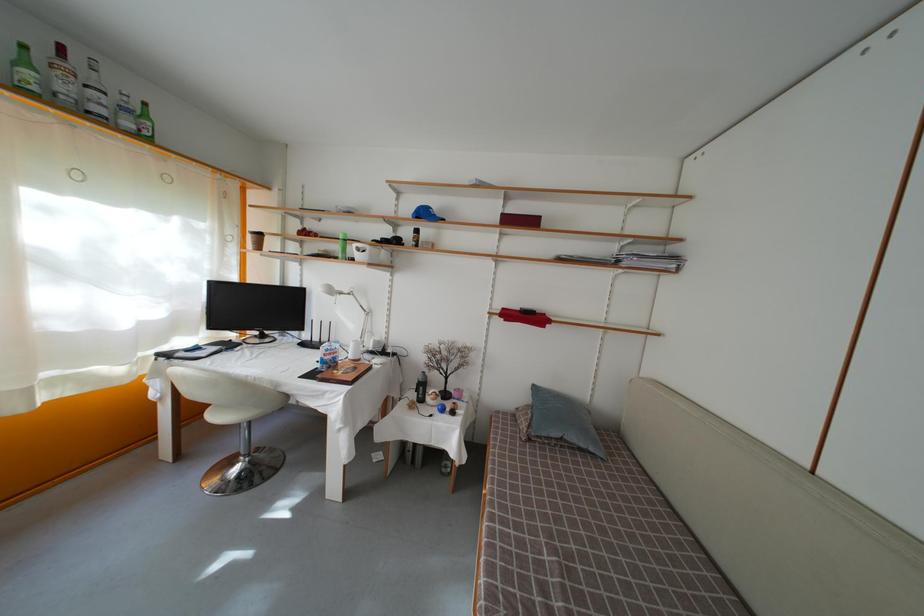
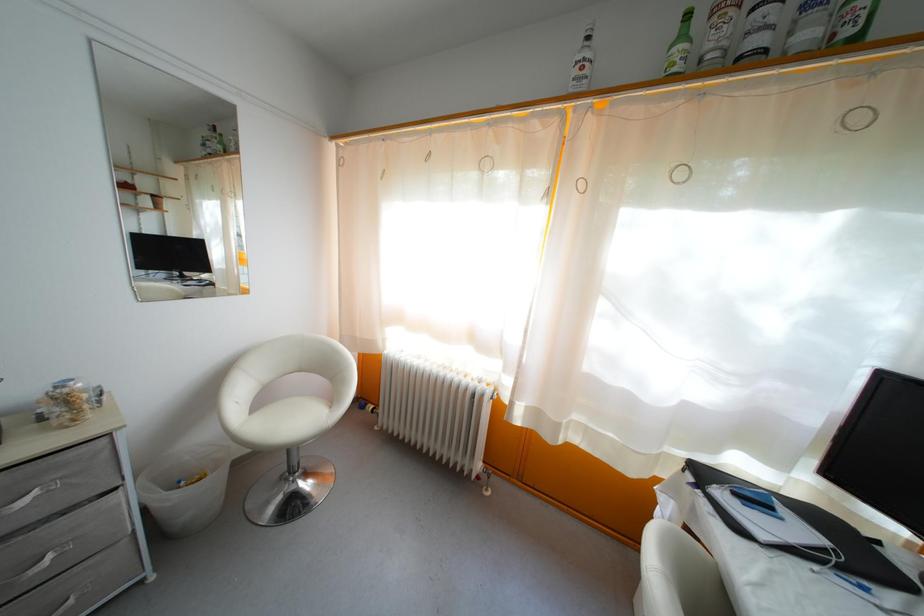
Where in the second image is the point corresponding to the point at 134,131 from the first image?

(812, 42)